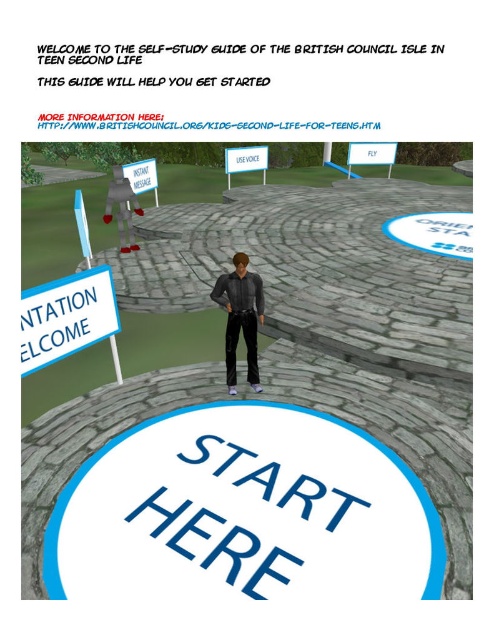
Question: Can you confirm if white paper sign at left is positioned to the right of matte black shirt at center?

Choices:
 (A) yes
 (B) no

Answer: (B)

Question: Which object appears farthest from the camera in this image?

Choices:
 (A) matte stone path at center
 (B) blue plastic sign at center
 (C) matte black shirt at center

Answer: (B)

Question: Among these points, which one is nearest to the camera?

Choices:
 (A) (146, 186)
 (B) (357, 144)

Answer: (A)

Question: Is blue plastic sign at center above white plastic sign at center?

Choices:
 (A) yes
 (B) no

Answer: (A)

Question: Is blue plastic sign at center to the left of white plastic sign at center from the viewer's perspective?

Choices:
 (A) no
 (B) yes

Answer: (A)

Question: Which of these objects is positioned farthest from the white plastic sign at center?

Choices:
 (A) matte stone path at center
 (B) blue plastic sign at center
 (C) white paper sign at center
 (D) matte black shirt at center

Answer: (D)